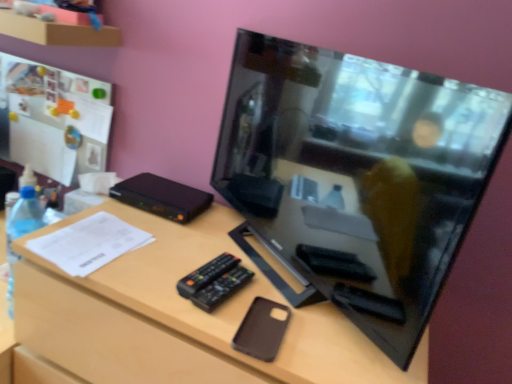
Question: From the image's perspective, is black glossy television at center located beneath brown matte phone case at center?

Choices:
 (A) yes
 (B) no

Answer: (B)

Question: Is black glossy television at center to the left of brown matte phone case at center from the viewer's perspective?

Choices:
 (A) no
 (B) yes

Answer: (A)

Question: Is there a large distance between black glossy television at center and brown matte phone case at center?

Choices:
 (A) no
 (B) yes

Answer: (A)

Question: Considering the relative sizes of black glossy television at center and brown matte phone case at center in the image provided, is black glossy television at center thinner than brown matte phone case at center?

Choices:
 (A) no
 (B) yes

Answer: (B)

Question: Is the depth of black glossy television at center less than that of brown matte phone case at center?

Choices:
 (A) no
 (B) yes

Answer: (B)

Question: From the image's perspective, is clear plastic bottle at left above or below black plastic remote at center?

Choices:
 (A) below
 (B) above

Answer: (B)

Question: In terms of height, does clear plastic bottle at left look taller or shorter compared to black plastic remote at center?

Choices:
 (A) tall
 (B) short

Answer: (A)

Question: Which is correct: clear plastic bottle at left is inside black plastic remote at center, or outside of it?

Choices:
 (A) inside
 (B) outside

Answer: (B)

Question: From a real-world perspective, is clear plastic bottle at left above or below black plastic remote at center?

Choices:
 (A) above
 (B) below

Answer: (B)

Question: Which is correct: brown matte phone case at center is inside black glossy television at center, or outside of it?

Choices:
 (A) outside
 (B) inside

Answer: (A)

Question: Is brown matte phone case at center taller or shorter than black glossy television at center?

Choices:
 (A) short
 (B) tall

Answer: (A)

Question: From a real-world perspective, is brown matte phone case at center physically located above or below black glossy television at center?

Choices:
 (A) above
 (B) below

Answer: (B)

Question: Would you say brown matte phone case at center is to the left or to the right of black glossy television at center in the picture?

Choices:
 (A) right
 (B) left

Answer: (B)

Question: Considering the positions of point (404, 188) and point (207, 266), is point (404, 188) closer or farther from the camera than point (207, 266)?

Choices:
 (A) farther
 (B) closer

Answer: (B)

Question: In terms of width, does black glossy television at center look wider or thinner when compared to black plastic remote at center?

Choices:
 (A) wide
 (B) thin

Answer: (B)